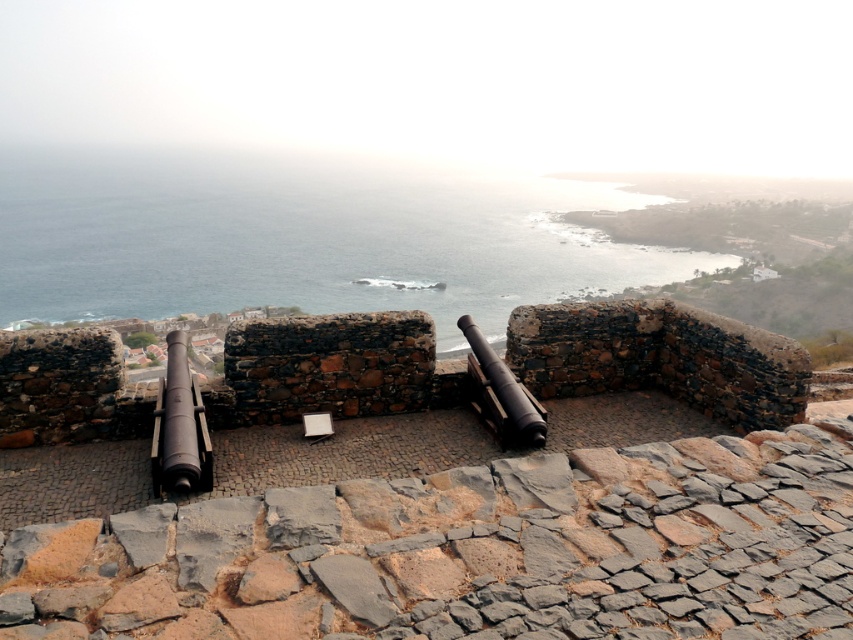
From the picture: You are a historian examining the coastal fort. You notice the blue water at center and the polished bronze cannon at left. Which object is located higher in the scene?

The blue water at center is positioned over the polished bronze cannon at left, so the blue water at center is higher.